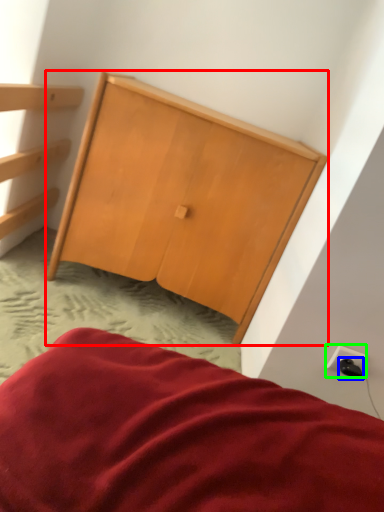
Question: Which is nearer to the furniture (highlighted by a red box)? plug (highlighted by a blue box) or electric outlet (highlighted by a green box).

Choices:
 (A) plug
 (B) electric outlet

Answer: (B)